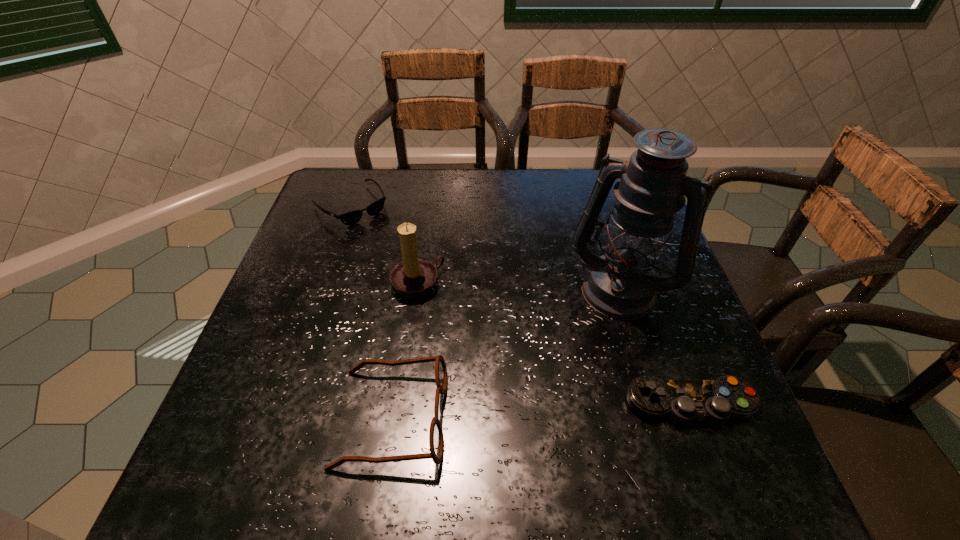
You are a GUI agent. You are given a task and a screenshot of the screen. Output one action in this format:
    pyautogui.click(x=<x>, y=<y>)
    Task: Click on the free space on the desktop that is between the spectacles and the control and is positioned on the front-facing side of the lantern
    
    Given the screenshot: What is the action you would take?
    pyautogui.click(x=564, y=410)

Locate an element on the screen. This screenshot has height=540, width=960. vacant space on the desktop that is between the third tallest object and the control and is positioned on the wick of the fourth shortest object is located at coordinates (547, 410).

Locate an element on the screen. This screenshot has width=960, height=540. free space on the desktop that is between the third shortest object and the control and is positioned on the front-facing side of the leftmost object is located at coordinates (553, 410).